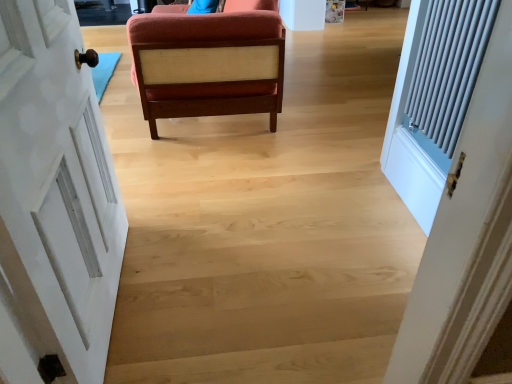
Question: Is white painted wood door at left inside the boundaries of velvet orange chair at center, or outside?

Choices:
 (A) outside
 (B) inside

Answer: (A)

Question: From the image's perspective, is white painted wood door at left above or below velvet orange chair at center?

Choices:
 (A) above
 (B) below

Answer: (B)

Question: In the image, is white painted wood door at left on the left side or the right side of velvet orange chair at center?

Choices:
 (A) right
 (B) left

Answer: (B)

Question: Considering the positions of velvet orange chair at center and white painted wood door at left in the image, is velvet orange chair at center wider or thinner than white painted wood door at left?

Choices:
 (A) wide
 (B) thin

Answer: (A)

Question: Is velvet orange chair at center spatially inside white painted wood door at left, or outside of it?

Choices:
 (A) inside
 (B) outside

Answer: (B)

Question: Is velvet orange chair at center in front of or behind white painted wood door at left in the image?

Choices:
 (A) behind
 (B) front

Answer: (A)

Question: From a real-world perspective, is velvet orange chair at center above or below white painted wood door at left?

Choices:
 (A) below
 (B) above

Answer: (A)